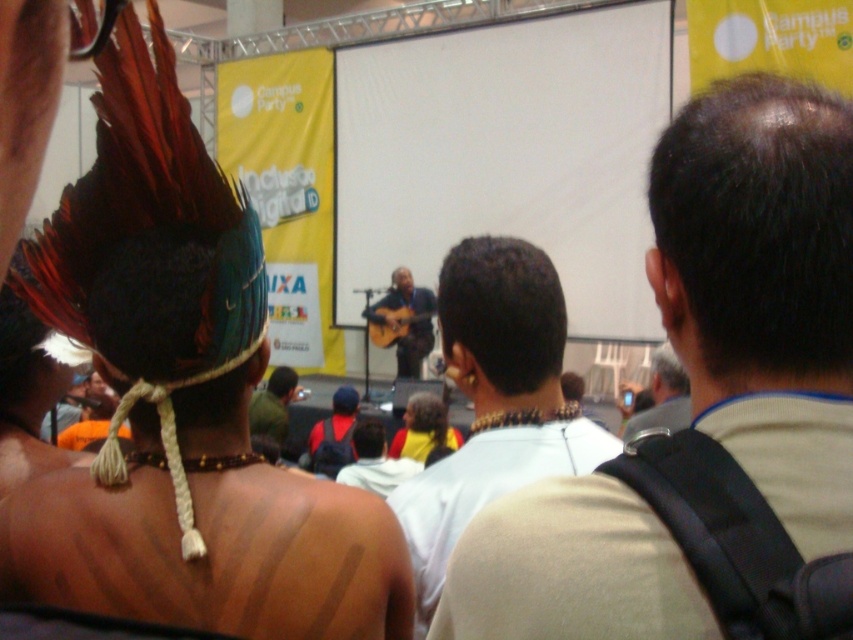
You are a photographer at the event and want to capture a shot that includes both the dark brown hair at center and the acoustic guitar at center. Based on their positions, which one is to the right of the other?

The dark brown hair at center is positioned on the right side of acoustic guitar at center.